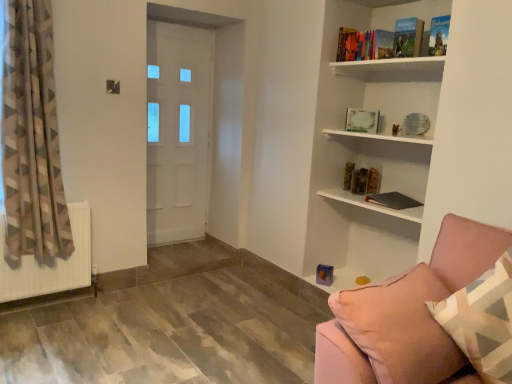
Where is `geometric-patterned fabric curtain at left`? The width and height of the screenshot is (512, 384). geometric-patterned fabric curtain at left is located at coordinates (32, 137).

Where is `pink fabric pillow at lower right`? pink fabric pillow at lower right is located at coordinates (482, 321).

In order to face matte black book at center, should I rotate leftwards or rightwards?

Turn right approximately 16.558 degrees to face it.

This screenshot has height=384, width=512. What do you see at coordinates (361, 180) in the screenshot? I see `matte brown book at upper center, which appears as the 2th book when ordered from the bottom` at bounding box center [361, 180].

I want to click on white matte frame at upper center, acting as the third book starting from the bottom, so click(x=362, y=120).

Which is closer to the camera, (353, 125) or (361, 201)?

The point (361, 201) is closer to the camera.

Considering the sizes of objects white matte frame at upper center, acting as the third book starting from the bottom, and matte black book at center in the image provided, who is shorter, white matte frame at upper center, acting as the third book starting from the bottom, or matte black book at center?

matte black book at center.

From the image's perspective, is white matte frame at upper center, acting as the third book starting from the bottom, below matte black book at center?

Actually, white matte frame at upper center, acting as the third book starting from the bottom, appears above matte black book at center in the image.

From a real-world perspective, who is located higher, white matte frame at upper center, which is the 4th book from top to bottom, or matte black book at center?

From a 3D spatial view, white matte frame at upper center, which is the 4th book from top to bottom, is above.

From a real-world perspective, who is located lower, hardcover book at upper right, the first book when ordered from bottom to top, or white matte radiator at lower left?

In real-world perspective, white matte radiator at lower left is lower.

In the image, is hardcover book at upper right, the first book when ordered from bottom to top, positioned in front of or behind white matte radiator at lower left?

Clearly, hardcover book at upper right, the first book when ordered from bottom to top, is behind white matte radiator at lower left.

Do you think hardcover book at upper right, the first book when ordered from bottom to top, is within white matte radiator at lower left, or outside of it?

hardcover book at upper right, the first book when ordered from bottom to top, is located beyond the bounds of white matte radiator at lower left.

Can you confirm if hardcover book at upper right, the first book when ordered from bottom to top, is wider than white matte radiator at lower left?

Yes, hardcover book at upper right, the first book when ordered from bottom to top, is wider than white matte radiator at lower left.

In the scene shown: Which of these two, pink fabric pillow at lower right or hardcover book at upper right, which appears as the fifth book when ordered from the bottom, is wider?

pink fabric pillow at lower right is wider.

Image resolution: width=512 pixels, height=384 pixels. There is a pink fabric pillow at lower right. Find the location of `the 5th book above it (from the image's perspective)`. the 5th book above it (from the image's perspective) is located at coordinates (408, 37).

From the image's perspective, between pink fabric pillow at lower right and hardcover book at upper right, which appears as the fifth book when ordered from the bottom, who is located below?

pink fabric pillow at lower right.

From a real-world perspective, which object stands above the other?

From a 3D spatial view, hardcover book at upper right, which appears as the fifth book when ordered from the bottom, is above.

Does point (10, 99) appear closer or farther from the camera than point (413, 25)?

Point (10, 99) appears to be closer to the viewer than point (413, 25).

From the picture: Is geometric-patterned fabric curtain at left shorter than hardcover book at upper right, which ranks as the 2th book in top-to-bottom order?

No, geometric-patterned fabric curtain at left is not shorter than hardcover book at upper right, which ranks as the 2th book in top-to-bottom order.

Is geometric-patterned fabric curtain at left not near hardcover book at upper right, which ranks as the 2th book in top-to-bottom order?

That's right, there is a large distance between geometric-patterned fabric curtain at left and hardcover book at upper right, which ranks as the 2th book in top-to-bottom order.

From the picture: Do you think geometric-patterned fabric curtain at left is within hardcover book at upper right, which ranks as the 2th book in top-to-bottom order, or outside of it?

geometric-patterned fabric curtain at left is not enclosed by hardcover book at upper right, which ranks as the 2th book in top-to-bottom order.

How much distance is there between matte black book at center and hardcover book at upper right, the 6th book positioned from the bottom?

A distance of 1.00 meters exists between matte black book at center and hardcover book at upper right, the 6th book positioned from the bottom.

From the image's perspective, is matte black book at center located beneath hardcover book at upper right, the 6th book positioned from the bottom?

Correct, matte black book at center appears lower than hardcover book at upper right, the 6th book positioned from the bottom, in the image.

Is the surface of matte black book at center in direct contact with hardcover book at upper right, the 6th book positioned from the bottom?

No, matte black book at center is not next to hardcover book at upper right, the 6th book positioned from the bottom.

Considering the relative positions of matte black book at center and hardcover book at upper right, the 6th book positioned from the bottom, in the image provided, is matte black book at center behind hardcover book at upper right, the 6th book positioned from the bottom,?

No, matte black book at center is closer to the camera.

The width and height of the screenshot is (512, 384). What are the coordinates of `the 1st book behind the hardcover book at upper right, the first book when ordered from bottom to top, starting your count from the anchor` in the screenshot? It's located at (362, 120).

Is white matte frame at upper center, acting as the third book starting from the bottom, smaller than hardcover book at upper right, the first book when ordered from bottom to top?

Correct, white matte frame at upper center, acting as the third book starting from the bottom, occupies less space than hardcover book at upper right, the first book when ordered from bottom to top.

From a real-world perspective, which object rests below the other?

In real-world perspective, hardcover book at upper right, the sixth book positioned from the top, is lower.

Measure the distance between white matte frame at upper center, acting as the third book starting from the bottom, and hardcover book at upper right, the first book when ordered from bottom to top.

white matte frame at upper center, acting as the third book starting from the bottom, and hardcover book at upper right, the first book when ordered from bottom to top, are 20.74 inches apart from each other.

Does point (45, 158) come in front of point (448, 304)?

No, it is behind (448, 304).

From the image's perspective, which one is positioned higher, geometric-patterned fabric curtain at left or pink fabric pillow at lower right?

geometric-patterned fabric curtain at left, from the image's perspective.

Who is taller, geometric-patterned fabric curtain at left or pink fabric pillow at lower right?

Standing taller between the two is geometric-patterned fabric curtain at left.

Is geometric-patterned fabric curtain at left outside of pink fabric pillow at lower right?

geometric-patterned fabric curtain at left is positioned outside pink fabric pillow at lower right.

The width and height of the screenshot is (512, 384). I want to click on the 3rd book positioned above the matte black book at center (from the image's perspective), so click(362, 120).

In the image, there is a hardcover book at upper right, the first book when ordered from bottom to top. In order to click on radiator below it (from the image's perspective) in this screenshot , I will do `click(47, 265)`.

Considering their positions, is hardcover book at upper right, which ranks as the 2th book in top-to-bottom order, positioned closer to white matte frame at upper center, which is the 4th book from top to bottom, than matte black book at center?

matte black book at center is positioned closer to the anchor white matte frame at upper center, which is the 4th book from top to bottom.

From the image, which object appears to be nearer to white matte frame at upper center, acting as the third book starting from the bottom, hardcover book at upper right, which appears as the fifth book when ordered from the bottom, or white matte radiator at lower left?

Based on the image, hardcover book at upper right, which appears as the fifth book when ordered from the bottom, appears to be nearer to white matte frame at upper center, acting as the third book starting from the bottom.

When comparing their distances from hardcover book at upper right, which ranks as the 2th book in top-to-bottom order, does pink fabric pillow at lower right or white glossy door at center seem closer?

Based on the image, pink fabric pillow at lower right appears to be nearer to hardcover book at upper right, which ranks as the 2th book in top-to-bottom order.

From the image, which object appears to be nearer to hardcover book at upper right, arranged as the 4th book when ordered from the bottom, white matte radiator at lower left or pink fabric couch at lower right?

pink fabric couch at lower right is positioned closer to the anchor hardcover book at upper right, arranged as the 4th book when ordered from the bottom.

From the image, which object appears to be nearer to matte black book at center, geometric-patterned fabric curtain at left or hardcover book at upper right, which appears as the first book when viewed from the top?

Among the two, hardcover book at upper right, which appears as the first book when viewed from the top, is located nearer to matte black book at center.

Which object lies nearer to the anchor point hardcover book at upper right, arranged as the third book when viewed from the top, white glossy door at center or matte brown book at upper center, which appears as the 2th book when ordered from the bottom?

matte brown book at upper center, which appears as the 2th book when ordered from the bottom.

Which object lies nearer to the anchor point hardcover book at upper right, arranged as the third book when viewed from the top, white matte frame at upper center, acting as the third book starting from the bottom, or white matte radiator at lower left?

The object closer to hardcover book at upper right, arranged as the third book when viewed from the top, is white matte frame at upper center, acting as the third book starting from the bottom.

Estimate the real-world distances between objects in this image. Which object is further from hardcover book at upper right, the first book when ordered from bottom to top, hardcover book at upper right, which appears as the first book when viewed from the top, or hardcover book at upper right, arranged as the 4th book when ordered from the bottom?

hardcover book at upper right, arranged as the 4th book when ordered from the bottom, is positioned further to the anchor hardcover book at upper right, the first book when ordered from bottom to top.

The height and width of the screenshot is (384, 512). Find the location of `radiator between pink fabric couch at lower right and white glossy door at center in the front-back direction`. radiator between pink fabric couch at lower right and white glossy door at center in the front-back direction is located at coordinates (47, 265).

At what (x,y) coordinates should I click in order to perform the action: click on shelf between geometric-patterned fabric curtain at left and hardcover book at upper right, the first book when ordered from bottom to top. Please return your answer as a coordinate pair (x, y). Looking at the image, I should click on tap(373, 204).

The height and width of the screenshot is (384, 512). In order to click on shelf positioned between pink fabric couch at lower right and hardcover book at upper right, the sixth book positioned from the top, from near to far in this screenshot , I will do `click(373, 204)`.

Locate an element on the screen. The height and width of the screenshot is (384, 512). shelf between geometric-patterned fabric curtain at left and hardcover book at upper right, which ranks as the 2th book in top-to-bottom order is located at coordinates (373, 204).